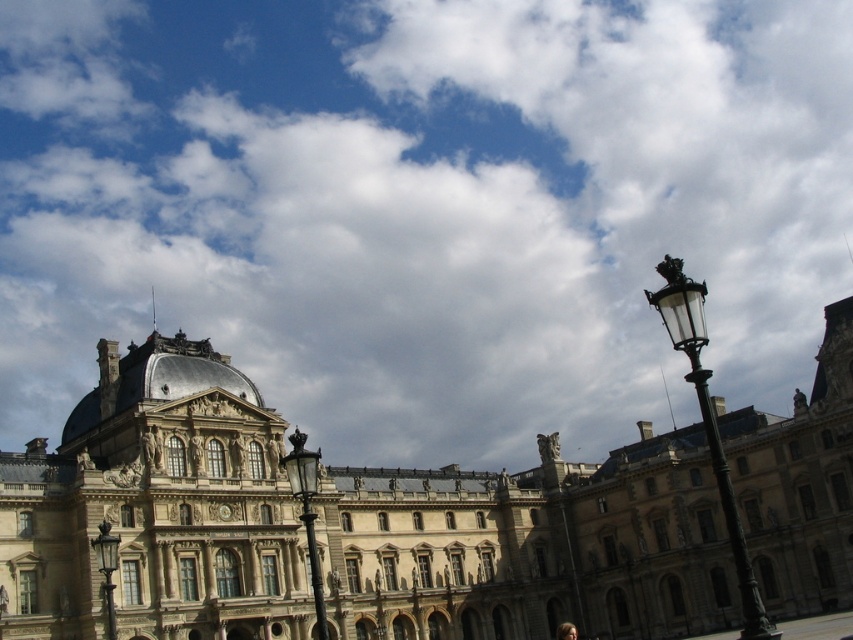
Question: Can you confirm if cloudy sky at upper center is thinner than golden stone palace at center?

Choices:
 (A) yes
 (B) no

Answer: (B)

Question: Which point is closer to the camera?

Choices:
 (A) (669, 445)
 (B) (247, 97)

Answer: (A)

Question: Is cloudy sky at upper center to the left of golden stone palace at center from the viewer's perspective?

Choices:
 (A) no
 (B) yes

Answer: (A)

Question: Does cloudy sky at upper center appear on the right side of golden stone palace at center?

Choices:
 (A) yes
 (B) no

Answer: (A)

Question: Which of the following is the closest to the observer?

Choices:
 (A) (173, 83)
 (B) (763, 502)

Answer: (B)